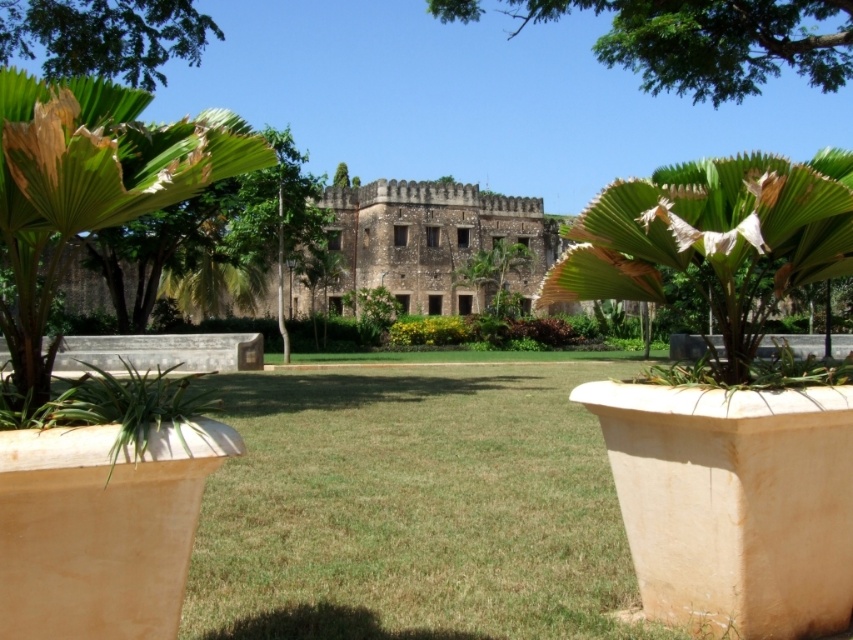
You are standing in the grassy area and want to walk to the stone building. Which object, the green leafy palm at left or the green leafy tree at upper center, would you pass by first?

The green leafy palm at left is closer to the viewer than the green leafy tree at upper center, so you would pass by the green leafy palm at left first on your way to the stone building.

You are a gardener assessing the plants in the scene. Which of the two plants, the green leafy palm at center or the green leafy tree at upper left, is taller?

The green leafy palm at center is taller than the green leafy tree at upper left according to the description.